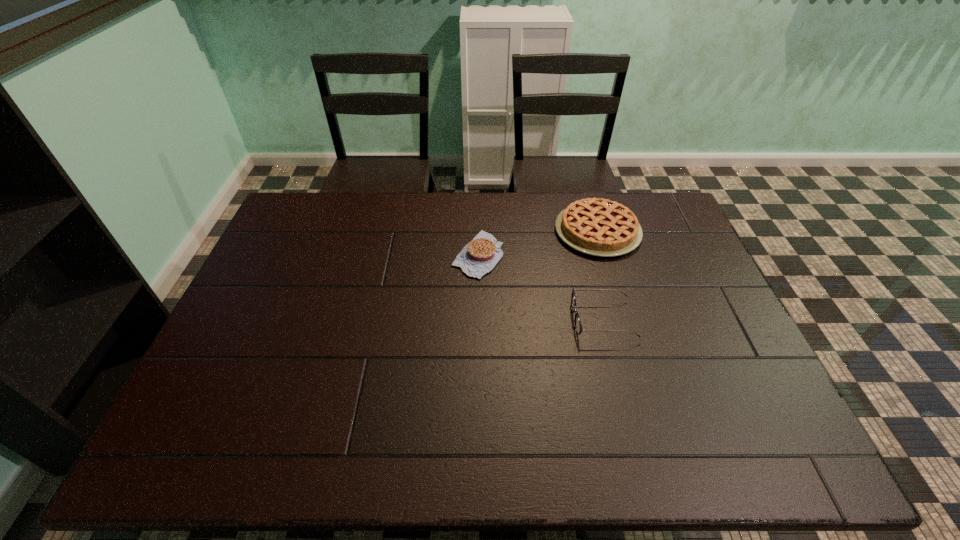
Find the location of a particular element. Image resolution: width=960 pixels, height=540 pixels. the taller pie is located at coordinates (600, 227).

At what (x,y) coordinates should I click in order to perform the action: click on spectacles. Please return your answer as a coordinate pair (x, y). Looking at the image, I should click on (578, 327).

Identify the location of the shortest object. (478, 257).

At what (x,y) coordinates should I click in order to perform the action: click on the left pie. Please return your answer as a coordinate pair (x, y). Looking at the image, I should click on (478, 257).

At what (x,y) coordinates should I click in order to perform the action: click on vacant space located 0.180m on the front of the taller pie. Please return your answer as a coordinate pair (x, y). This screenshot has width=960, height=540. Looking at the image, I should click on (618, 302).

Image resolution: width=960 pixels, height=540 pixels. What are the coordinates of `vacant region located through the lenses of the nearest object` in the screenshot? It's located at (537, 320).

What are the coordinates of `free region located 0.090m through the lenses of the nearest object` in the screenshot? It's located at (540, 320).

At what (x,y) coordinates should I click in order to perform the action: click on free point located 0.230m through the lenses of the nearest object. Please return your answer as a coordinate pair (x, y). The width and height of the screenshot is (960, 540). Looking at the image, I should click on (491, 320).

At what (x,y) coordinates should I click in order to perform the action: click on vacant space positioned 0.270m on the left of the leftmost object. Please return your answer as a coordinate pair (x, y). Image resolution: width=960 pixels, height=540 pixels. Looking at the image, I should click on (370, 255).

Locate an element on the screen. object located at the right edge is located at coordinates (600, 227).